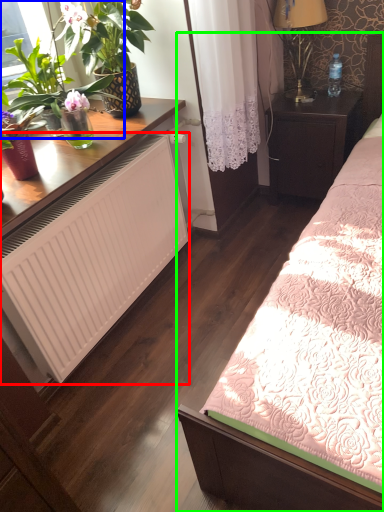
Question: Considering the real-world distances, which object is farthest from radiator (highlighted by a red box)? houseplant (highlighted by a blue box) or bed (highlighted by a green box)?

Choices:
 (A) houseplant
 (B) bed

Answer: (B)